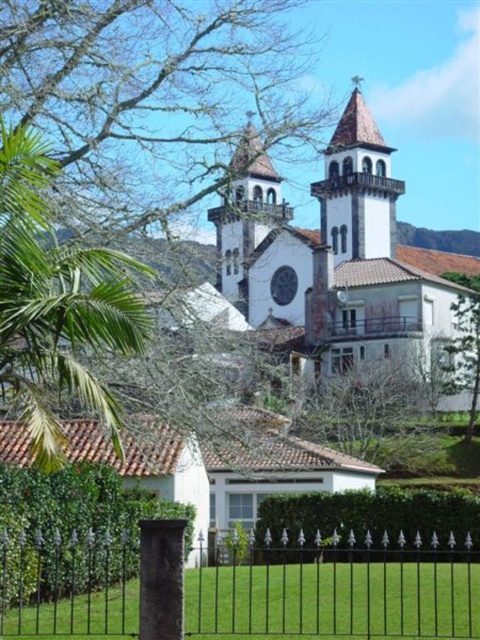
Question: Among these objects, which one is nearest to the camera?

Choices:
 (A) white stucco church at center
 (B) black wrought iron fence at lower center
 (C) green leafy tree at center

Answer: (B)

Question: From the image, what is the correct spatial relationship of green leafy palm tree at center in relation to green leafy hedge at lower center?

Choices:
 (A) right
 (B) left

Answer: (B)

Question: Is green leafy hedge at lower left below green leafy hedge at lower center?

Choices:
 (A) no
 (B) yes

Answer: (A)

Question: Considering the real-world distances, which object is closest to the white stucco church at center?

Choices:
 (A) brown tiled spire at upper center
 (B) green leafy tree at center
 (C) green leafy palm tree at center

Answer: (A)

Question: Which of these objects is positioned closest to the black wrought iron fence at lower center?

Choices:
 (A) white stucco church at center
 (B) brown tiled spire at upper center
 (C) green leafy hedge at lower center
 (D) green leafy tree at center

Answer: (C)

Question: Is green leafy hedge at lower center further to camera compared to brown tiled spire at upper center?

Choices:
 (A) no
 (B) yes

Answer: (A)